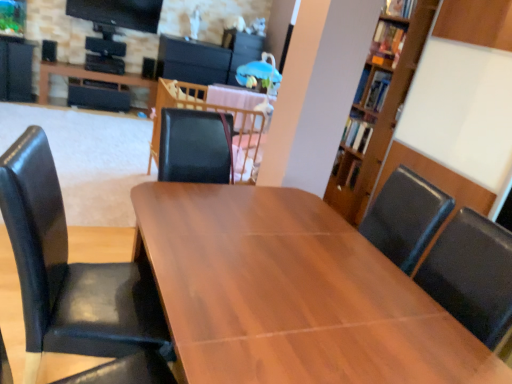
Question: Is point (44, 258) positioned closer to the camera than point (244, 105)?

Choices:
 (A) closer
 (B) farther

Answer: (A)

Question: Considering the positions of black leather chair at left and wooden table at center, the 2th table in the top-to-bottom sequence, in the image, is black leather chair at left wider or thinner than wooden table at center, the 2th table in the top-to-bottom sequence,?

Choices:
 (A) wide
 (B) thin

Answer: (A)

Question: Which object is positioned farthest from the black leather chair at left?

Choices:
 (A) matte black speaker at upper left, arranged as the second speaker when viewed from the right
 (B) matte black table at upper left, acting as the 3th table starting from the bottom
 (C) black matte speaker at upper center, the first speaker in the back-to-front sequence
 (D) wooden table at center, the 2th table in the top-to-bottom sequence
 (E) wooden table at center, placed as the first table when sorted from right to left

Answer: (A)

Question: Which object is the closest to the wooden table at center, the 2th table in the top-to-bottom sequence?

Choices:
 (A) black leather chair at left
 (B) matte black table at upper left, the 3th table when ordered from right to left
 (C) wooden table at center, the first table viewed from the front
 (D) black matte speaker at upper center, which appears as the second speaker when viewed from the front
 (E) matte black speaker at upper left, the 1th speaker from the left

Answer: (C)